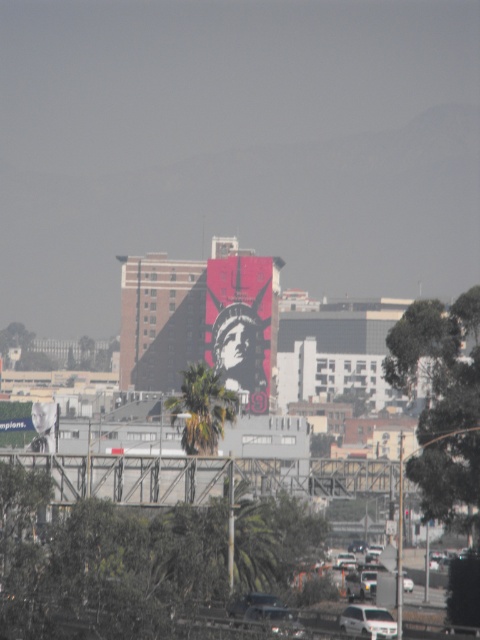
Question: Which point appears farthest from the camera in this image?

Choices:
 (A) (374, 627)
 (B) (245, 330)

Answer: (B)

Question: Observing the image, what is the correct spatial positioning of green leafy palm tree at center in reference to white matte car at lower center?

Choices:
 (A) below
 (B) above

Answer: (B)

Question: Which object is positioned closest to the white matte car at lower center?

Choices:
 (A) stained glass statue at center
 (B) green leafy palm tree at center

Answer: (B)

Question: Where is stained glass statue at center located in relation to white matte car at lower center in the image?

Choices:
 (A) below
 (B) above

Answer: (B)

Question: Does green leafy palm tree at center appear on the left side of white matte car at lower center?

Choices:
 (A) yes
 (B) no

Answer: (A)

Question: Which of these objects is positioned farthest from the white matte car at lower center?

Choices:
 (A) green leafy palm tree at center
 (B) stained glass statue at center

Answer: (B)